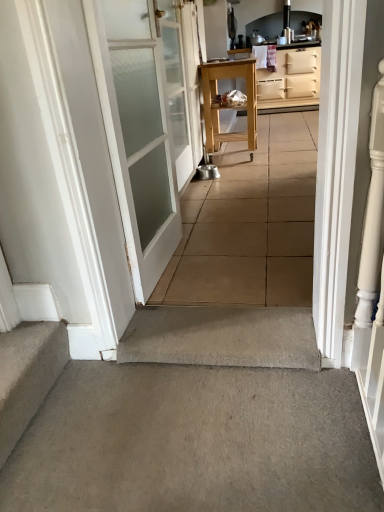
Question: Considering the relative positions of carpeted stairs at lower left and beige matte cabinet at upper right in the image provided, is carpeted stairs at lower left to the left or to the right of beige matte cabinet at upper right?

Choices:
 (A) right
 (B) left

Answer: (B)

Question: Is carpeted stairs at lower left taller or shorter than beige matte cabinet at upper right?

Choices:
 (A) short
 (B) tall

Answer: (A)

Question: Which of these objects is positioned farthest from the carpeted stairs at lower left?

Choices:
 (A) white frosted glass door at left, marked as the second door in a back-to-front arrangement
 (B) beige matte cabinet at upper right
 (C) natural wood table at center
 (D) gray concrete at center
 (E) white frosted glass door at upper left, positioned as the 1th door in back-to-front order

Answer: (B)

Question: Which of these objects is positioned farthest from the gray concrete at center?

Choices:
 (A) beige matte cabinet at upper right
 (B) white frosted glass door at upper left, positioned as the 1th door in back-to-front order
 (C) white frosted glass door at left, marked as the second door in a back-to-front arrangement
 (D) carpeted stairs at lower left
 (E) natural wood table at center

Answer: (A)